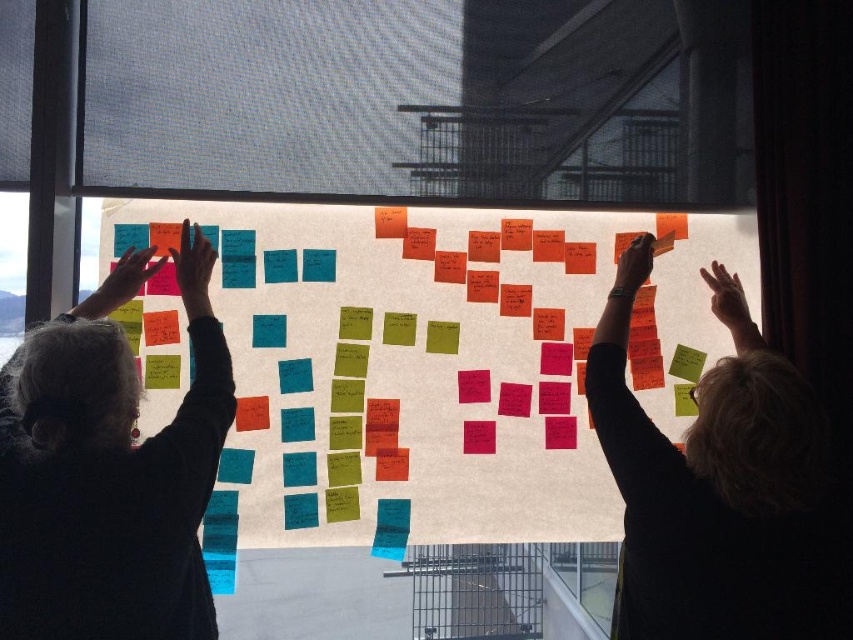
You are standing in the room and looking at the large sheet of paper on the window with two points marked. Which point is closer to you, point (630, 458) or point (733, 294)?

Point (630, 458) is closer to the viewer than point (733, 294).

You are a person who needs to reach an object on the window. You are standing at the same position as the person wearing the smooth black shirt at upper right. The object you need is located at the position of the translucent skin hand at upper right. Can you reach it without moving your feet?

The distance between the smooth black shirt at upper right and the translucent skin hand at upper right is 16.14 inches. Since the average human arm length is about 27 inches, you can easily reach the object without moving your feet.

You are a new team member joining a brainstorming session. You see the colorful sticky notes at center and the smooth black shirt at upper right. Which object is located more to the left side?

The colorful sticky notes at center is positioned on the left side of smooth black shirt at upper right, so it is more to the left.